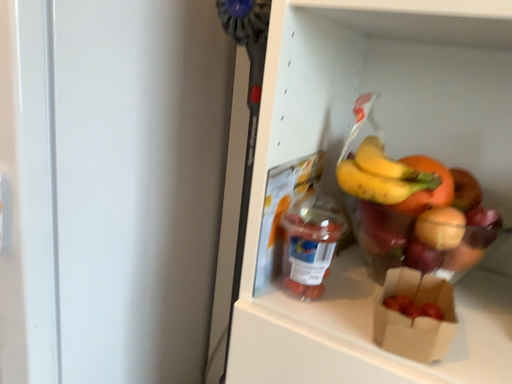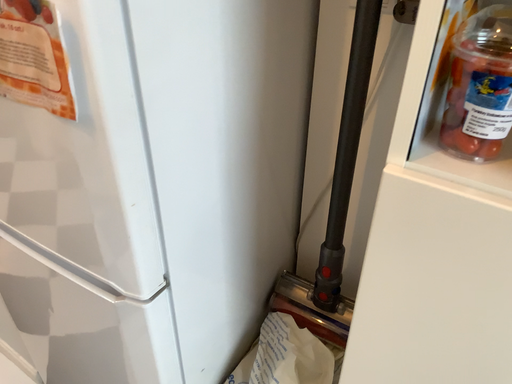
Question: Which way did the camera rotate in the video?

Choices:
 (A) rotated downward
 (B) rotated upward

Answer: (A)